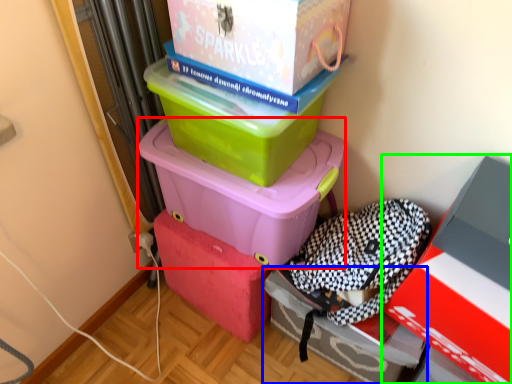
Question: Considering the real-world distances, which object is farthest from box (highlighted by a red box)? box (highlighted by a blue box) or box (highlighted by a green box)?

Choices:
 (A) box
 (B) box

Answer: (B)